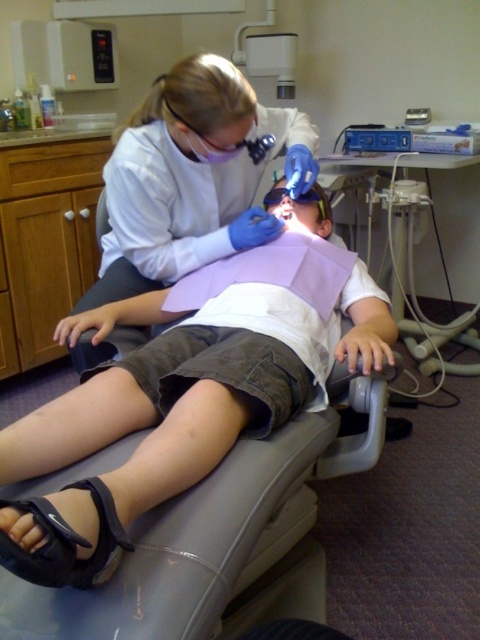
Is white glossy lab coat at upper center to the right of blue plastic dental chair at center from the viewer's perspective?

No, white glossy lab coat at upper center is not to the right of blue plastic dental chair at center.

Can you confirm if white glossy lab coat at upper center is taller than blue plastic dental chair at center?

No.

Is point (180, 172) in front of point (434, 141)?

That is True.

Find the location of `white glossy lab coat at upper center`. white glossy lab coat at upper center is located at coordinates (192, 177).

Is blue plastic dental chair at center further to camera compared to black synthetic sandal at lower left?

Yes, it is.

Does blue plastic dental chair at center appear over black synthetic sandal at lower left?

Yes, blue plastic dental chair at center is above black synthetic sandal at lower left.

Where is `blue plastic dental chair at center`? This screenshot has width=480, height=640. blue plastic dental chair at center is located at coordinates (414, 224).

Can you confirm if white glossy lab coat at upper center is positioned to the left of black synthetic sandal at lower left?

No, white glossy lab coat at upper center is not to the left of black synthetic sandal at lower left.

What are the coordinates of `white glossy lab coat at upper center` in the screenshot? It's located at (192, 177).

The image size is (480, 640). I want to click on white glossy lab coat at upper center, so click(192, 177).